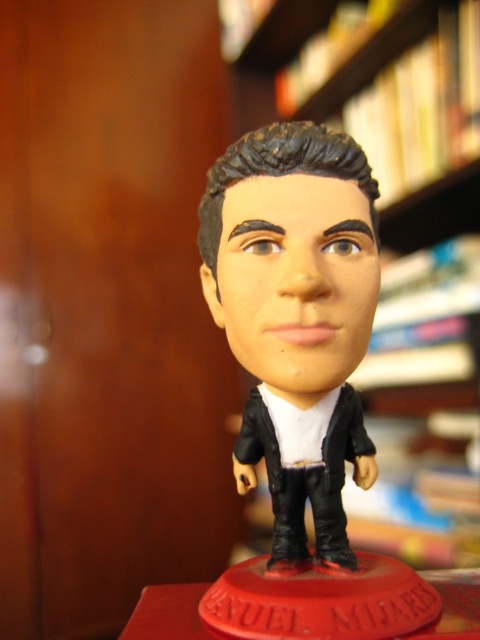
Question: Which point appears closest to the camera in this image?

Choices:
 (A) (382, 285)
 (B) (340, 545)

Answer: (B)

Question: Which point appears farthest from the camera in this image?

Choices:
 (A) (428, 552)
 (B) (325, 468)

Answer: (A)

Question: Among these objects, which one is nearest to the camera?

Choices:
 (A) black matte business suit at center
 (B) wooden bookshelf at upper center

Answer: (A)

Question: Is black matte business suit at center thinner than wooden bookshelf at upper center?

Choices:
 (A) yes
 (B) no

Answer: (A)

Question: From the image, what is the correct spatial relationship of black matte business suit at center in relation to wooden bookshelf at upper center?

Choices:
 (A) right
 (B) left

Answer: (B)

Question: Is black matte business suit at center closer to the viewer compared to wooden bookshelf at upper center?

Choices:
 (A) yes
 (B) no

Answer: (A)